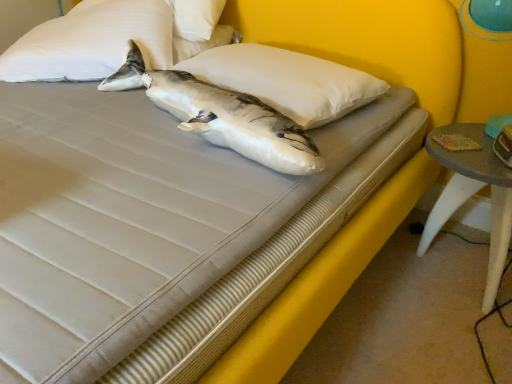
Question: From a real-world perspective, is yellow fabric bed frame at center physically below white soft pillow at upper left, the 1th pillow viewed from the left?

Choices:
 (A) no
 (B) yes

Answer: (B)

Question: Is yellow fabric bed frame at center outside of white soft pillow at upper left, the 1th pillow viewed from the left?

Choices:
 (A) yes
 (B) no

Answer: (A)

Question: Is yellow fabric bed frame at center wider than white soft pillow at upper left, positioned as the 2th pillow in right-to-left order?

Choices:
 (A) no
 (B) yes

Answer: (B)

Question: Is the position of yellow fabric bed frame at center more distant than that of white soft pillow at upper left, the 1th pillow viewed from the left?

Choices:
 (A) yes
 (B) no

Answer: (B)

Question: Is the depth of yellow fabric bed frame at center less than that of white soft pillow at upper left, positioned as the 2th pillow in right-to-left order?

Choices:
 (A) no
 (B) yes

Answer: (B)

Question: From a real-world perspective, is yellow fabric bed frame at center on top of white soft pillow at upper left, positioned as the 2th pillow in right-to-left order?

Choices:
 (A) yes
 (B) no

Answer: (B)

Question: From the image's perspective, is white soft pillow at center, arranged as the 2th pillow when viewed from the left, below white matte shark at center?

Choices:
 (A) yes
 (B) no

Answer: (B)

Question: Could you tell me if white soft pillow at center, arranged as the 2th pillow when viewed from the left, is facing white matte shark at center?

Choices:
 (A) no
 (B) yes

Answer: (B)

Question: Considering the relative sizes of white soft pillow at center, arranged as the 2th pillow when viewed from the left, and white matte shark at center in the image provided, is white soft pillow at center, arranged as the 2th pillow when viewed from the left, taller than white matte shark at center?

Choices:
 (A) yes
 (B) no

Answer: (B)

Question: Is white soft pillow at center, positioned as the first pillow in right-to-left order, far from white matte shark at center?

Choices:
 (A) yes
 (B) no

Answer: (B)

Question: Can you confirm if white soft pillow at center, arranged as the 2th pillow when viewed from the left, is positioned to the left of white matte shark at center?

Choices:
 (A) no
 (B) yes

Answer: (A)

Question: Is white soft pillow at center, arranged as the 2th pillow when viewed from the left, outside of white matte shark at center?

Choices:
 (A) no
 (B) yes

Answer: (B)

Question: Can you confirm if yellow fabric bed frame at center is positioned to the right of white matte shark at center?

Choices:
 (A) no
 (B) yes

Answer: (A)